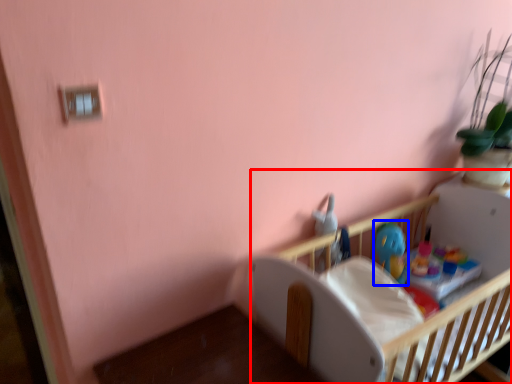
Question: Among these objects, which one is farthest to the camera, infant bed (highlighted by a red box) or toy (highlighted by a blue box)?

Choices:
 (A) infant bed
 (B) toy

Answer: (B)